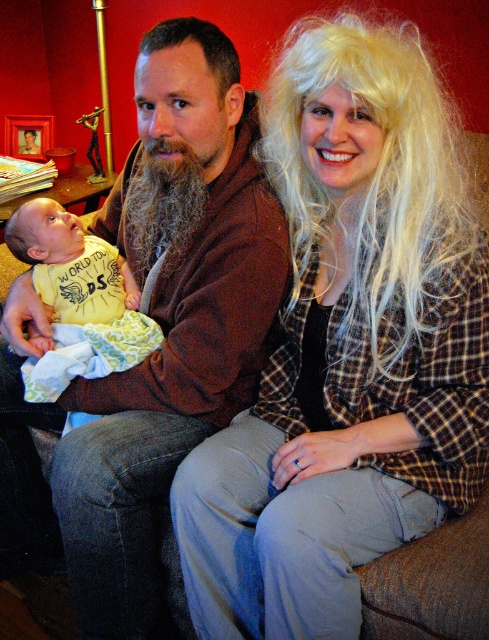
Looking at this image, you are a photographer trying to capture a closeup shot of the blonde hair at center and the brown soft sweater at center. The camera you are using has a maximum focus range of 20 centimeters. Can you fit both subjects within the camera focus range without moving the camera?

The blonde hair at center and brown soft sweater at center are 20.91 centimeters apart. Since the camera can only focus within 20 centimeters, the distance between them exceeds the focus range. You cannot fit both subjects within the camera focus range without moving the camera.